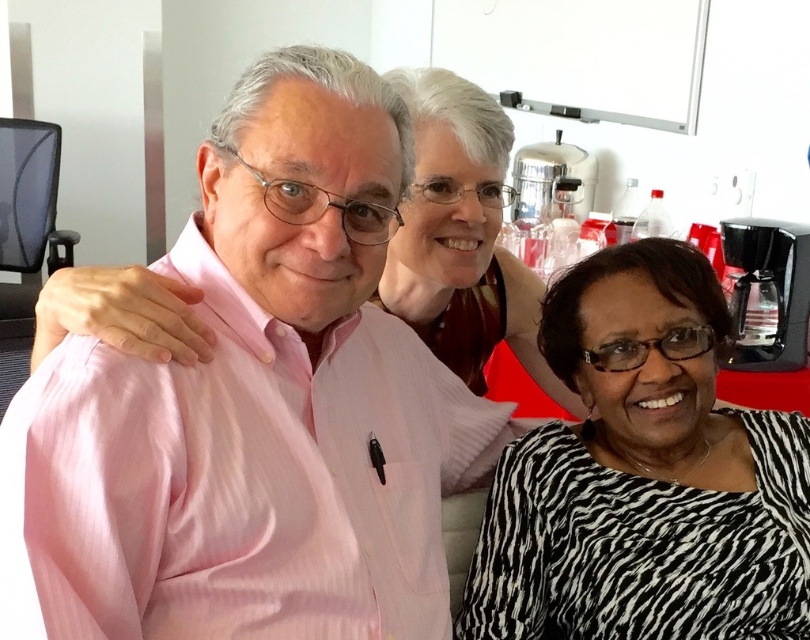
Measure the distance from pink striped shirt at left to zebra-patterned blouse at center.

32.73 centimeters

Can you confirm if pink striped shirt at left is positioned below zebra-patterned blouse at center?

Actually, pink striped shirt at left is above zebra-patterned blouse at center.

The width and height of the screenshot is (810, 640). Identify the location of pink striped shirt at left. (254, 406).